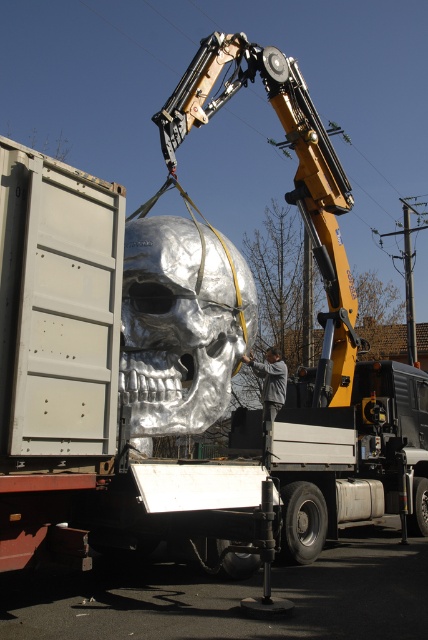
You are a crane operator trying to lift the silver metallic skull at center and the shiny metallic skull at center onto the truck bed. Which one should you lift first to avoid blocking the other?

You should lift the shiny metallic skull at center first because the silver metallic skull at center is positioned under it, so lifting the upper one first would prevent blocking access to the lower one.

You are a safety inspector observing the loading process of the silver metallic skull at center and the gray fabric jacket at center. Based on their positions, which object is more likely to pose a falling hazard if the crane operator loses control?

The silver metallic skull at center is closer to the viewer than the gray fabric jacket at center, so if the crane operator loses control, the silver metallic skull at center would be more likely to pose a falling hazard because it is nearer to the ground and closer to potential bystanders.

You are a safety inspector checking the loading process of the shiny metallic skull at center onto the truck. The gray fabric jacket at center is the worker assisting. Based on the scene, which object is taller and could potentially pose a height risk if not secured properly?

The shiny metallic skull at center is taller than the gray fabric jacket at center, so it is the object that could potentially pose a height risk if not secured properly.